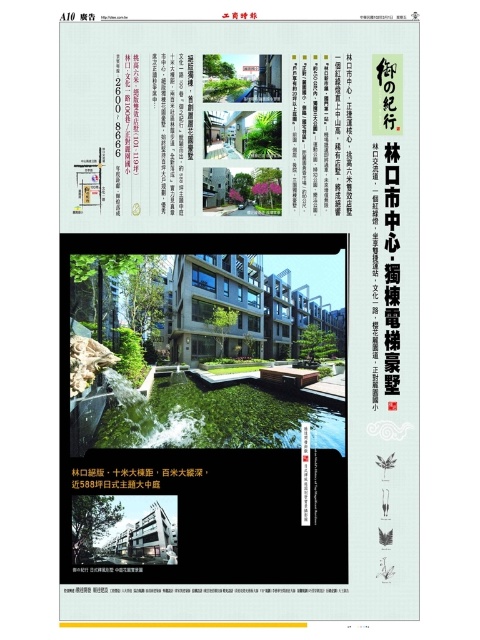
Question: Is black paper at upper left wider than white paper at upper center?

Choices:
 (A) yes
 (B) no

Answer: (A)

Question: Does black paper at upper left have a smaller size compared to white paper at upper center?

Choices:
 (A) no
 (B) yes

Answer: (A)

Question: From the image, what is the correct spatial relationship of black paper at upper left in relation to white paper at upper center?

Choices:
 (A) above
 (B) below

Answer: (A)

Question: Which point is closer to the camera?

Choices:
 (A) (132, 124)
 (B) (331, 132)

Answer: (A)